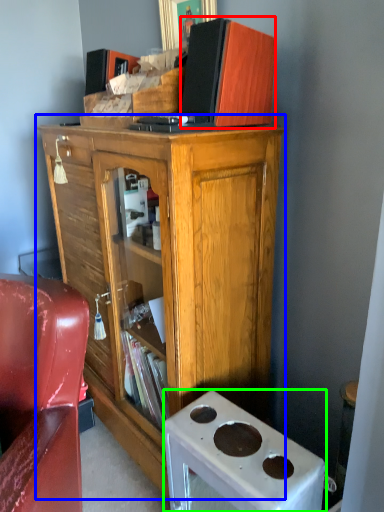
Question: Which object is positioned farthest from book (highlighted by a red box)? Select from cabinetry (highlighted by a blue box) and desk (highlighted by a green box).

Choices:
 (A) cabinetry
 (B) desk

Answer: (B)